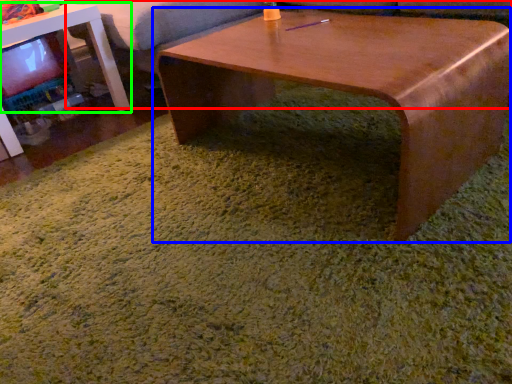
Question: Which is farther away from couch (highlighted by a red box)? coffee table (highlighted by a blue box) or table (highlighted by a green box)?

Choices:
 (A) coffee table
 (B) table

Answer: (A)